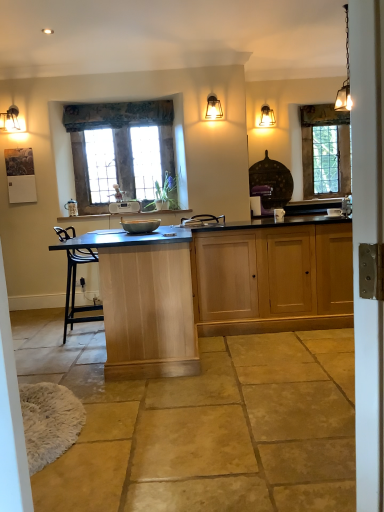
Where is `vacant space in front of light wood cabinet at center`? Image resolution: width=384 pixels, height=512 pixels. vacant space in front of light wood cabinet at center is located at coordinates (272, 348).